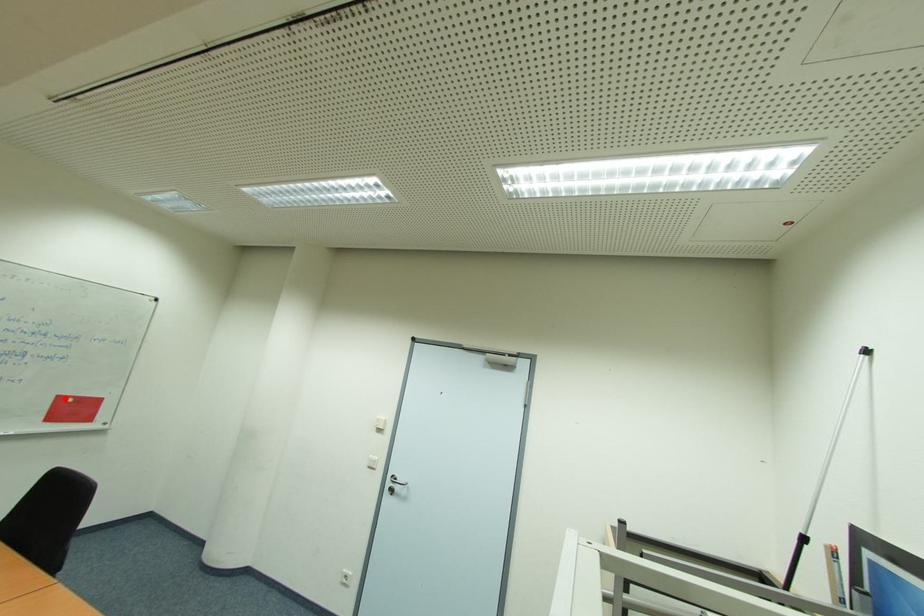
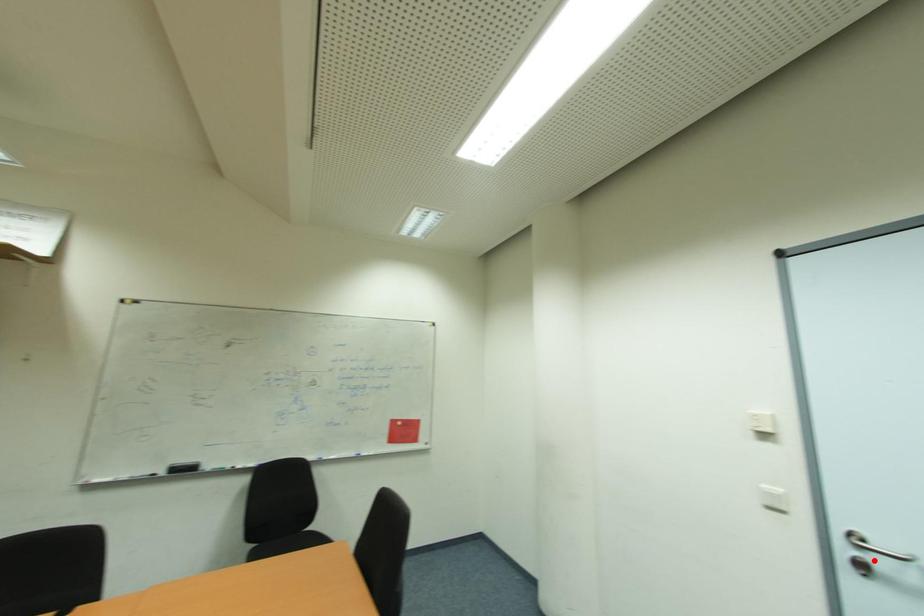
I am providing you with two images of the same scene from different viewpoints. A red point is marked on the first image and another point is marked on the second image. Does the point marked in image1 correspond to the same location as the one in image2?

No